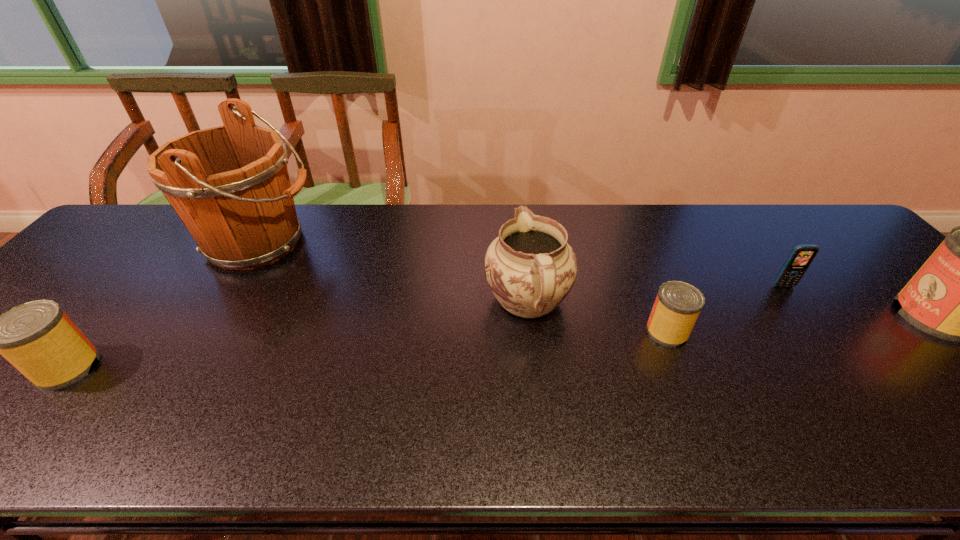
Locate an element on the screen. free space located 0.300m on the spout of the third object from left to right is located at coordinates (516, 207).

At what (x,y) coordinates should I click in order to perform the action: click on vacant space located 0.100m on the spout of the third object from left to right. Please return your answer as a coordinate pair (x, y). The image size is (960, 540). Looking at the image, I should click on (521, 245).

Identify the location of vacant region located 0.200m with the handle on the side of the fifth object from right to left. The width and height of the screenshot is (960, 540). (387, 242).

Locate an element on the screen. This screenshot has height=540, width=960. free region located 0.110m on the screen of the fifth object from left to right is located at coordinates (809, 320).

Locate an element on the screen. This screenshot has width=960, height=540. object that is at the far edge is located at coordinates (230, 186).

The width and height of the screenshot is (960, 540). I want to click on object at the near edge, so click(x=37, y=337).

Locate an element on the screen. This screenshot has width=960, height=540. object present at the left edge is located at coordinates (37, 337).

Where is `object that is positioned at the near left corner`? The width and height of the screenshot is (960, 540). object that is positioned at the near left corner is located at coordinates (37, 337).

This screenshot has height=540, width=960. In order to click on free space at the far edge of the desktop in this screenshot , I will do `click(394, 217)`.

This screenshot has height=540, width=960. In the image, there is a desktop. Identify the location of vacant region at the near edge. (352, 408).